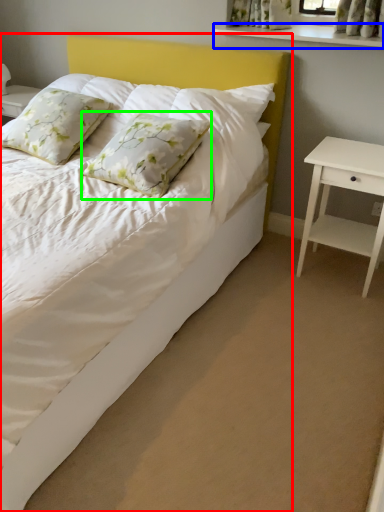
Question: Which is nearer to the bed (highlighted by a red box)? window sill (highlighted by a blue box) or pillow (highlighted by a green box).

Choices:
 (A) window sill
 (B) pillow

Answer: (B)